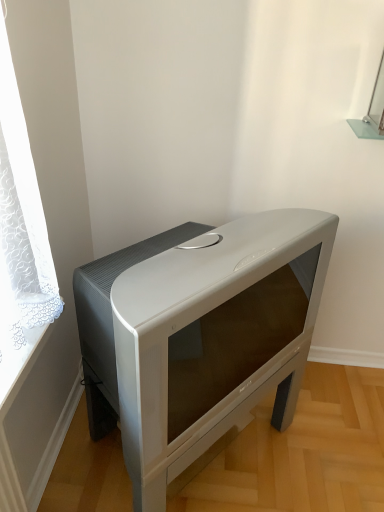
What are the coordinates of `spots to the right of white matte television at center` in the screenshot? It's located at (321, 440).